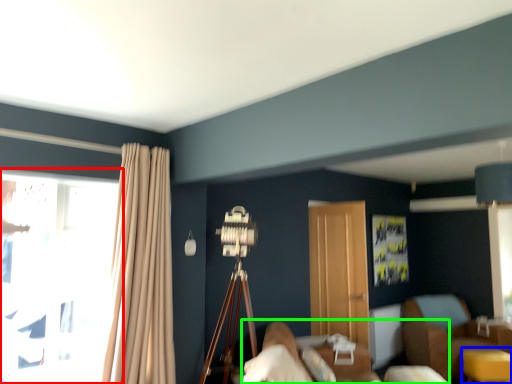
Question: Estimate the real-world distances between objects in this image. Which object is farther from window (highlighted by a red box), table (highlighted by a blue box) or bed (highlighted by a green box)?

Choices:
 (A) table
 (B) bed

Answer: (A)